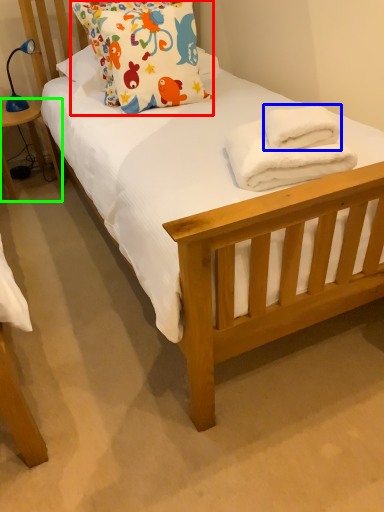
Question: Estimate the real-world distances between objects in this image. Which object is farther from pillow (highlighted by a red box), bath towel (highlighted by a blue box) or table (highlighted by a green box)?

Choices:
 (A) bath towel
 (B) table

Answer: (B)